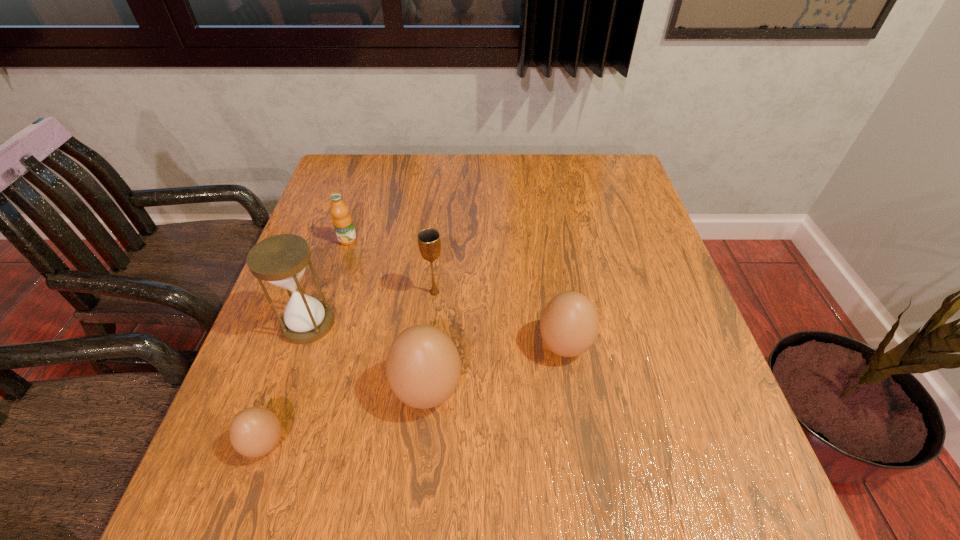
Find the location of a particular element. This screenshot has height=540, width=960. free point that keeps the boiled eggs evenly spaced on the right is located at coordinates (682, 307).